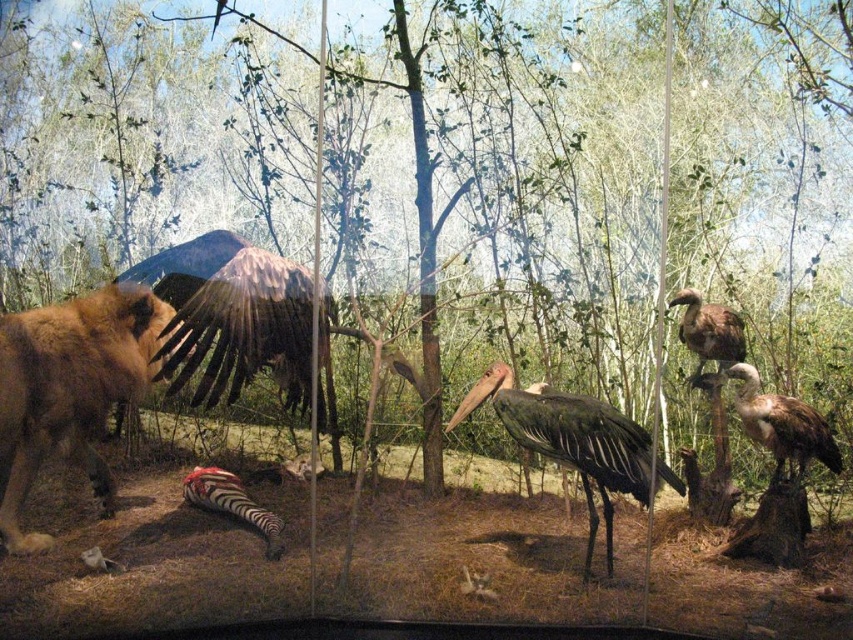
You are a museum visitor holding a 1.2 meter wide display panel that needs to fit between the dark gray matte stork at center and the brown feathered vulture at upper right. Can you determine if the panel will fit based on their widths?

The dark gray matte stork at center is wider than the brown feathered vulture at upper right. However, the exact width of the space between them isn not provided. The panel requires 1.2 meters. Without knowing the distance between the two birds, it is impossible to determine if the panel will fit.

You are a visitor at the museum and want to take a photo of the brown feathered vulture at center. The camera you have can focus on objects up to 5 meters away. Will the camera be able to capture the vulture clearly?

The brown feathered vulture at center is 4.07 meters away from the camera, which is within the camera focus range of up to 5 meters. Therefore, the camera can capture the vulture clearly.